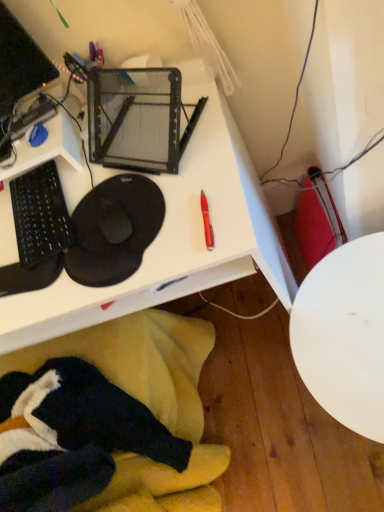
At what (x,y) coordinates should I click in order to perform the action: click on vacant space underneath black matte mouse pad at left (from a real-world perspective). Please return your answer as a coordinate pair (x, y). Looking at the image, I should click on (117, 214).